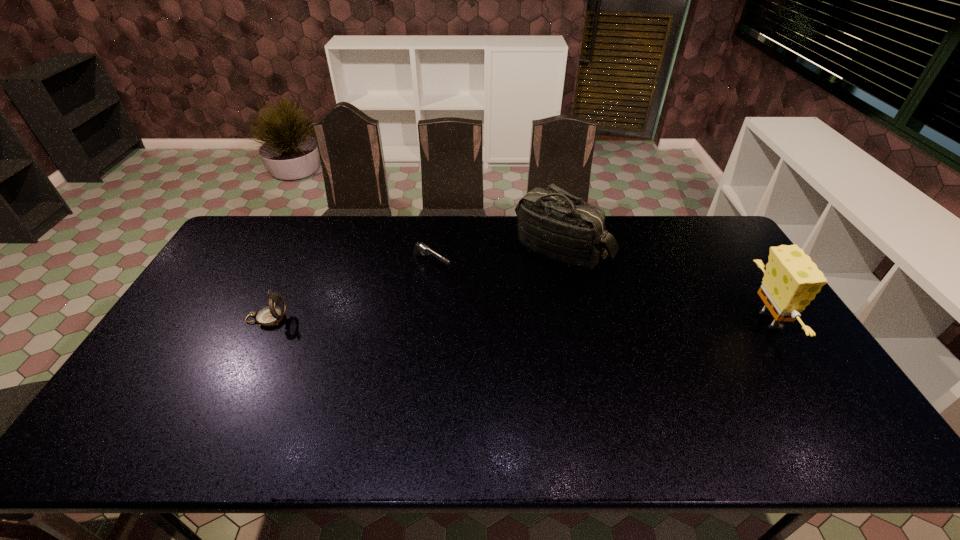
You are a GUI agent. You are given a task and a screenshot of the screen. Output one action in this format:
    pyautogui.click(x=<x>, y=<y>)
    Task: Click on the second shortest object
    The image size is (960, 540).
    Given the screenshot: What is the action you would take?
    pos(272,315)

Where is `the leftmost object`? The image size is (960, 540). the leftmost object is located at coordinates (272, 315).

Identify the location of sponge. Image resolution: width=960 pixels, height=540 pixels. (791, 280).

The height and width of the screenshot is (540, 960). I want to click on pistol, so point(419,248).

Image resolution: width=960 pixels, height=540 pixels. I want to click on the second object from left to right, so click(x=419, y=248).

Image resolution: width=960 pixels, height=540 pixels. Find the location of `the third object from left to right`. the third object from left to right is located at coordinates (552, 223).

This screenshot has width=960, height=540. In order to click on free space located on the face of the second shortest object in this screenshot , I will do `click(327, 319)`.

I want to click on blank space located 0.070m on the front-facing side of the third object from right to left, so click(460, 284).

Locate an element on the screen. vacant space located on the front-facing side of the third object from right to left is located at coordinates (465, 287).

Image resolution: width=960 pixels, height=540 pixels. Find the location of `free space located 0.340m on the front-facing side of the third object from right to left`. free space located 0.340m on the front-facing side of the third object from right to left is located at coordinates (526, 328).